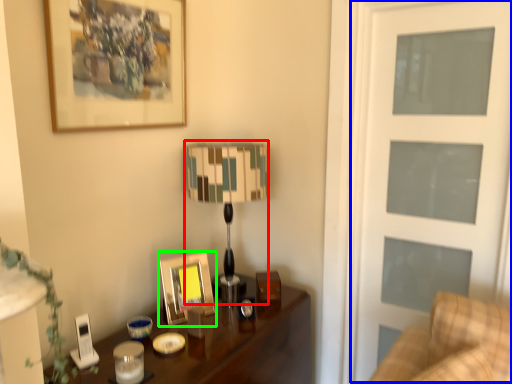
Question: Considering the real-world distances, which object is farthest from table lamp (highlighted by a red box)? screen door (highlighted by a blue box) or picture frame (highlighted by a green box)?

Choices:
 (A) screen door
 (B) picture frame

Answer: (A)